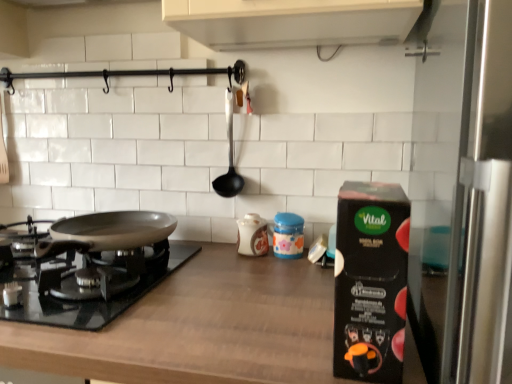
The width and height of the screenshot is (512, 384). I want to click on spots to the right of silver metallic pan at lower left, so click(236, 292).